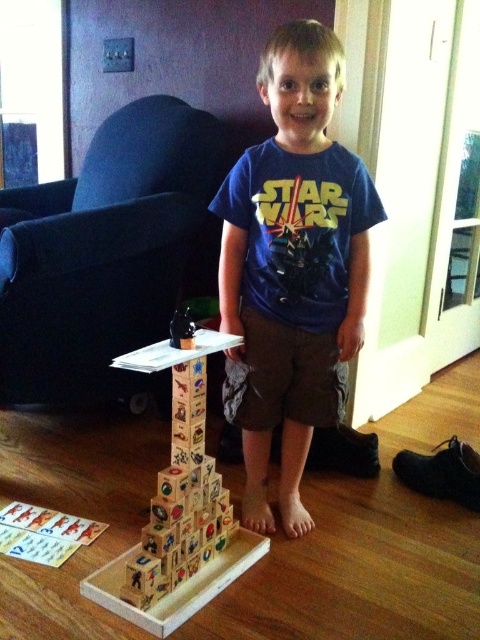
Can you confirm if blue cotton shirt at center is shorter than wooden blocks at center?

Incorrect, blue cotton shirt at center's height does not fall short of wooden blocks at center's.

Where is `blue cotton shirt at center`? The width and height of the screenshot is (480, 640). blue cotton shirt at center is located at coordinates (292, 268).